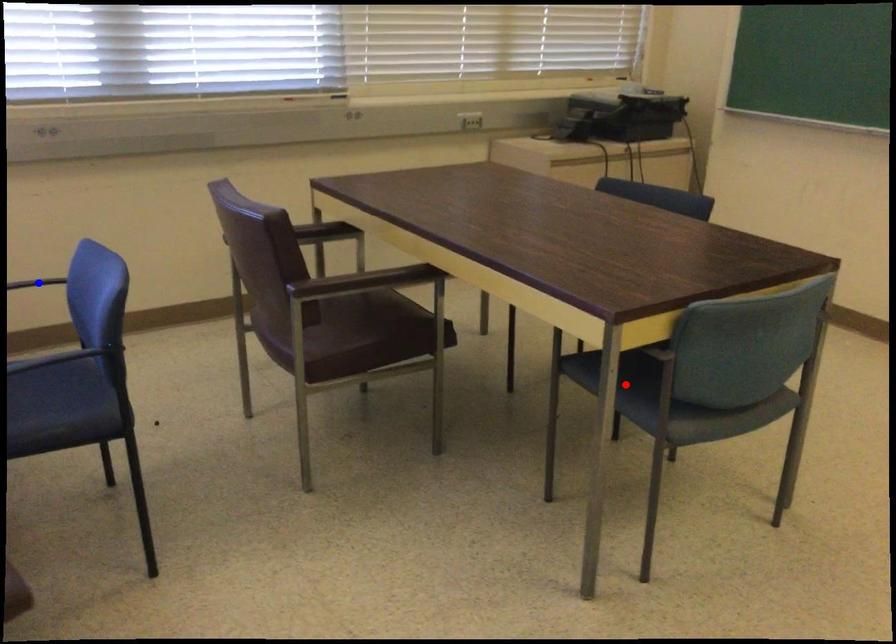
Question: Which of the two points in the image is closer to the camera?

Choices:
 (A) Blue point is closer.
 (B) Red point is closer.

Answer: (B)